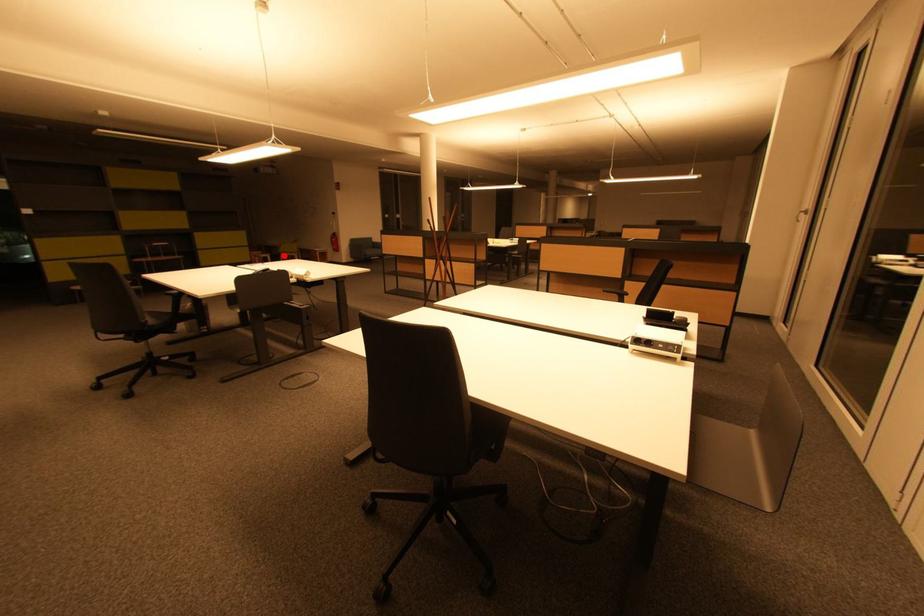
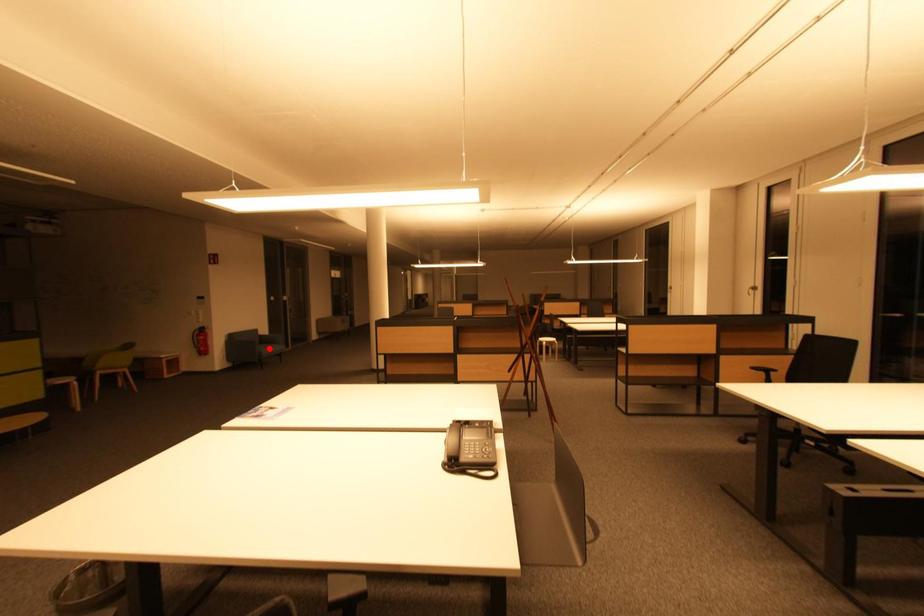
I am providing you with two images of the same scene from different viewpoints. A red point is marked on the first image and another point is marked on the second image. Does the point marked in image1 correspond to the same location as the one in image2?

No